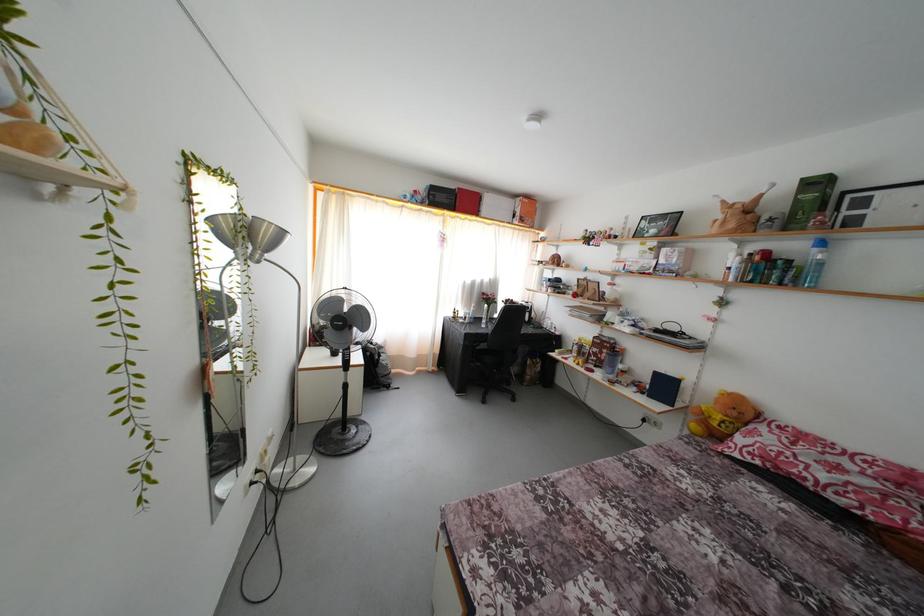
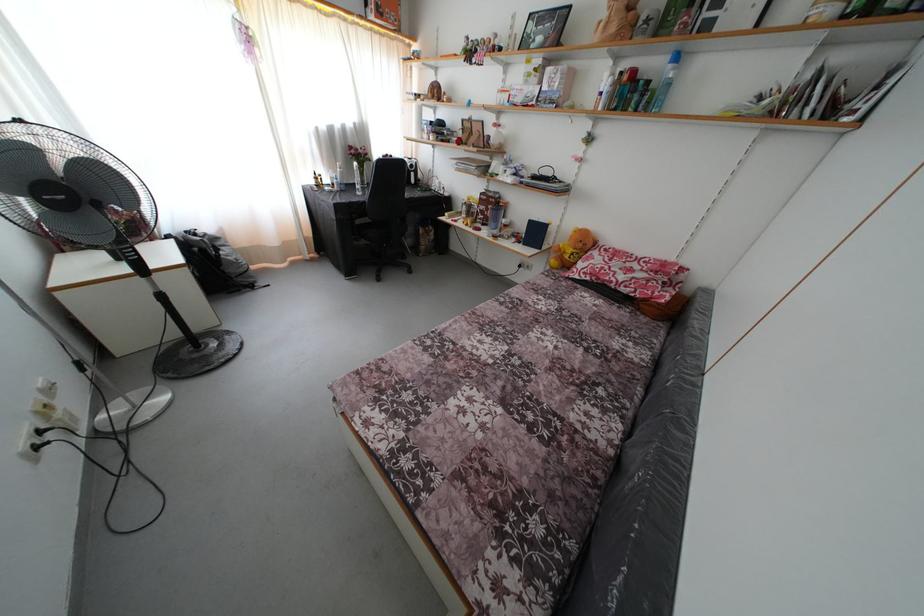
Where in the second image is the point corresponding to point (693, 448) from the first image?

(552, 282)